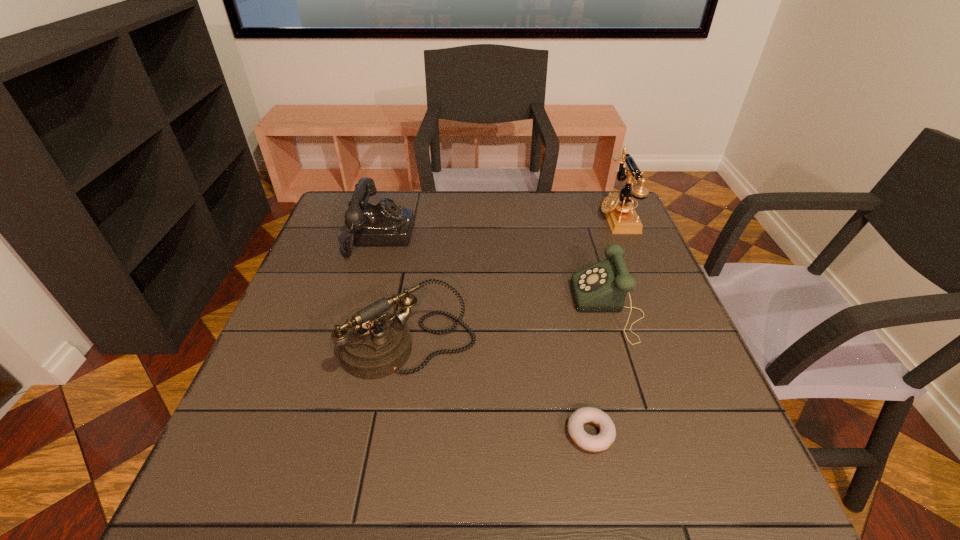
Where is `the second shortest object`? This screenshot has height=540, width=960. the second shortest object is located at coordinates (602, 287).

Image resolution: width=960 pixels, height=540 pixels. What are the coordinates of `the shortest object` in the screenshot? It's located at (593, 443).

The height and width of the screenshot is (540, 960). Find the location of `the nearest object`. the nearest object is located at coordinates (593, 443).

Where is `vacant space located 0.170m on the dial of the fourth tallest object`? This screenshot has height=540, width=960. vacant space located 0.170m on the dial of the fourth tallest object is located at coordinates (504, 308).

Where is `vacant space located on the dial of the fourth tallest object`? vacant space located on the dial of the fourth tallest object is located at coordinates (438, 308).

Locate an element on the screen. free region located 0.300m on the dial of the fourth tallest object is located at coordinates (450, 308).

Find the location of a particular element. The image size is (960, 540). free space located on the right of the nearest object is located at coordinates (640, 433).

Identify the location of object that is at the left edge. This screenshot has height=540, width=960. (383, 224).

The height and width of the screenshot is (540, 960). Find the location of `object that is at the far left corner`. object that is at the far left corner is located at coordinates (383, 224).

Where is `object that is at the far right corner`? object that is at the far right corner is located at coordinates (620, 213).